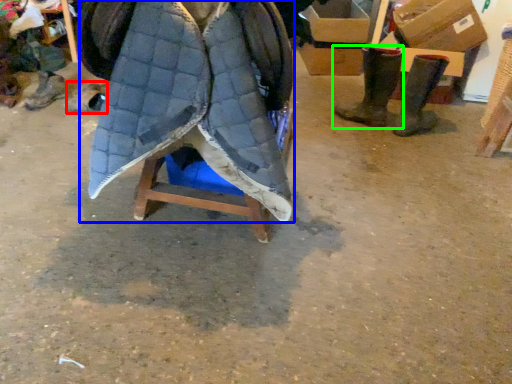
Question: Based on their relative distances, which object is nearer to footwear (highlighted by a red box)? Choose from cloak (highlighted by a blue box) and footwear (highlighted by a green box).

Choices:
 (A) cloak
 (B) footwear

Answer: (A)